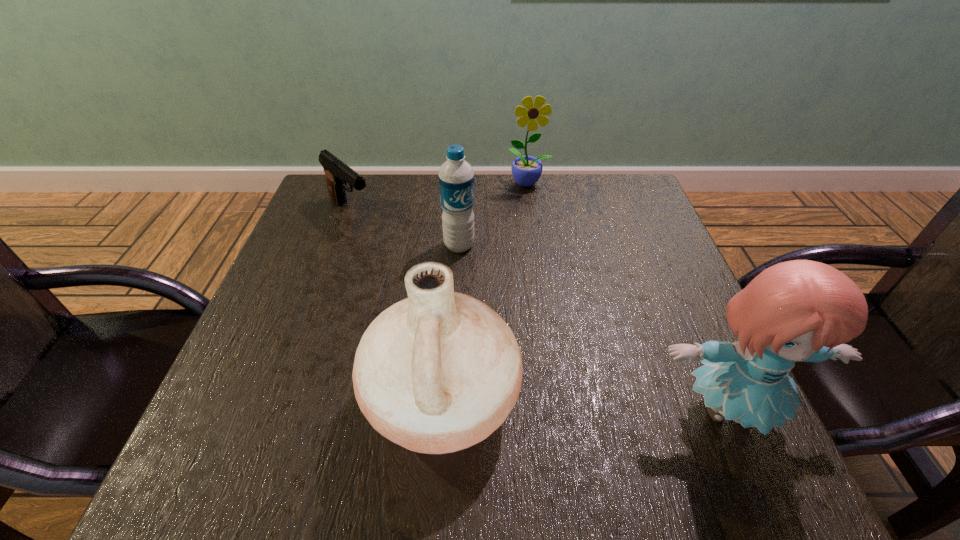
Identify the location of free space on the desktop that is between the pottery and the doll and is positioned on the label of the water bottle. The height and width of the screenshot is (540, 960). (588, 406).

At what (x,y) coordinates should I click in order to perform the action: click on vacant space on the desktop that is between the pottery and the doll and is positioned at the barrel of the pistol. Please return your answer as a coordinate pair (x, y). This screenshot has width=960, height=540. Looking at the image, I should click on (575, 405).

You are a GUI agent. You are given a task and a screenshot of the screen. Output one action in this format:
    pyautogui.click(x=<x>, y=<y>)
    Task: Click on the free spot on the desktop that is between the pottery and the rightmost object and is positioned on the front-facing side of the second object from right to left
    This screenshot has width=960, height=540.
    Given the screenshot: What is the action you would take?
    pyautogui.click(x=561, y=404)